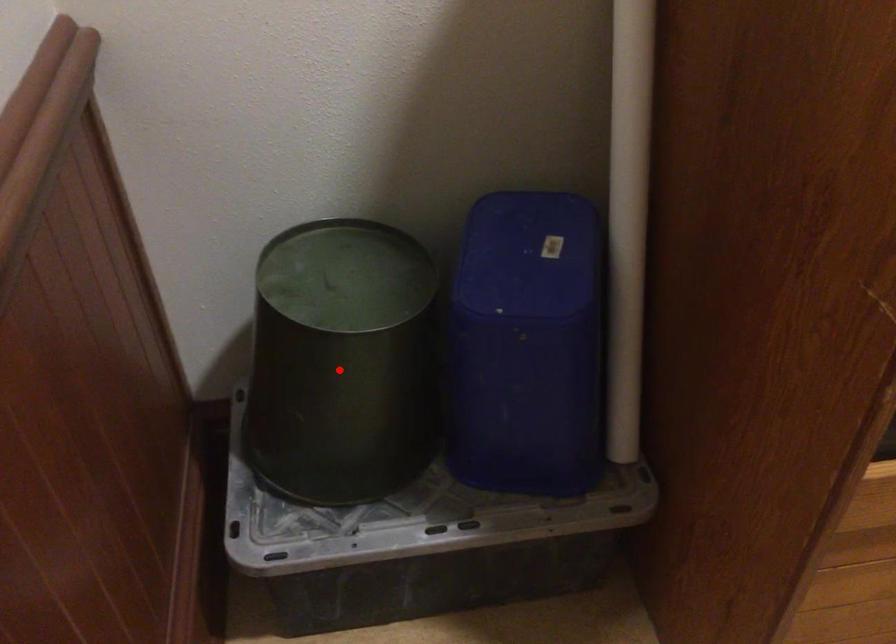
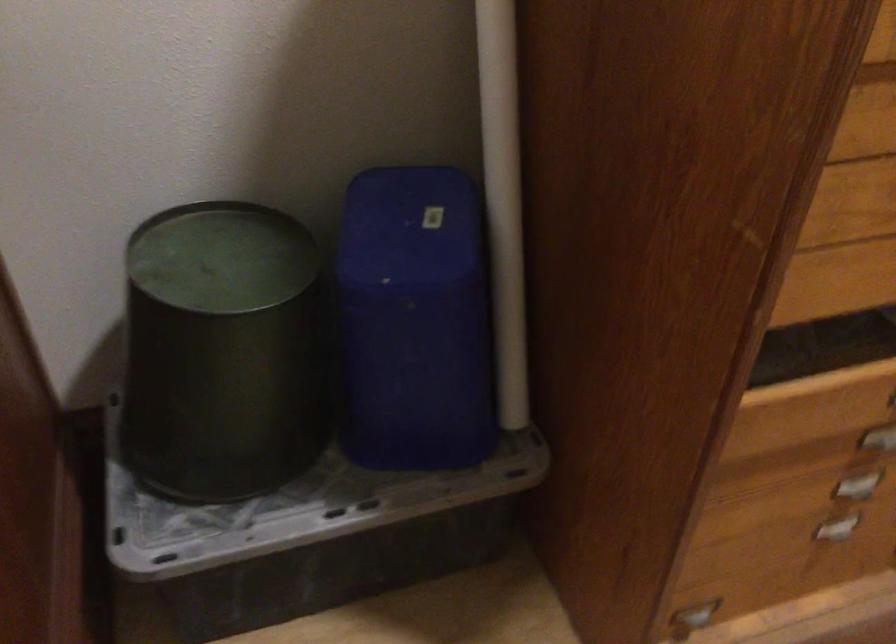
Where in the second image is the point corresponding to the highlighted location from the first image?

(222, 352)